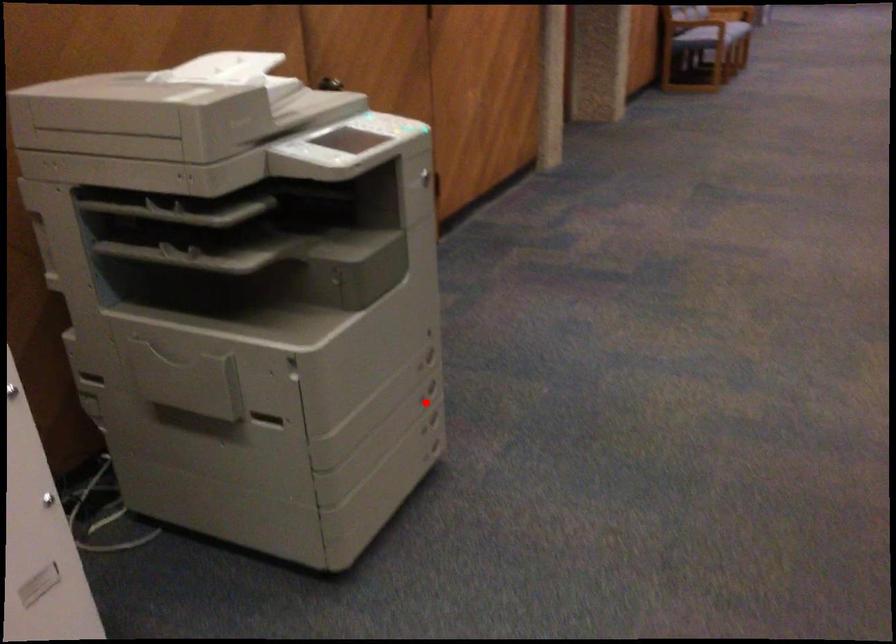
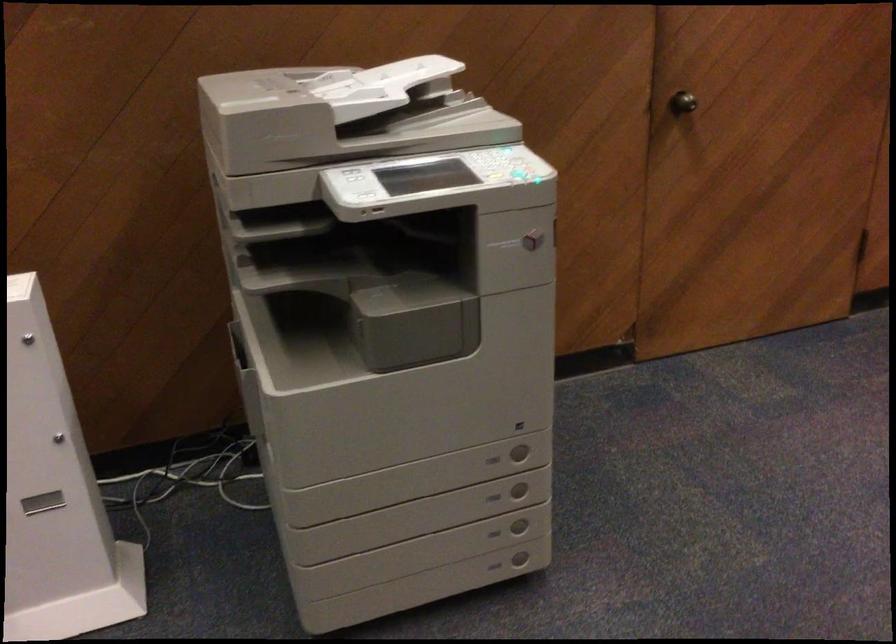
Where in the second image is the point corresponding to the highlighted location from the first image?

(493, 497)